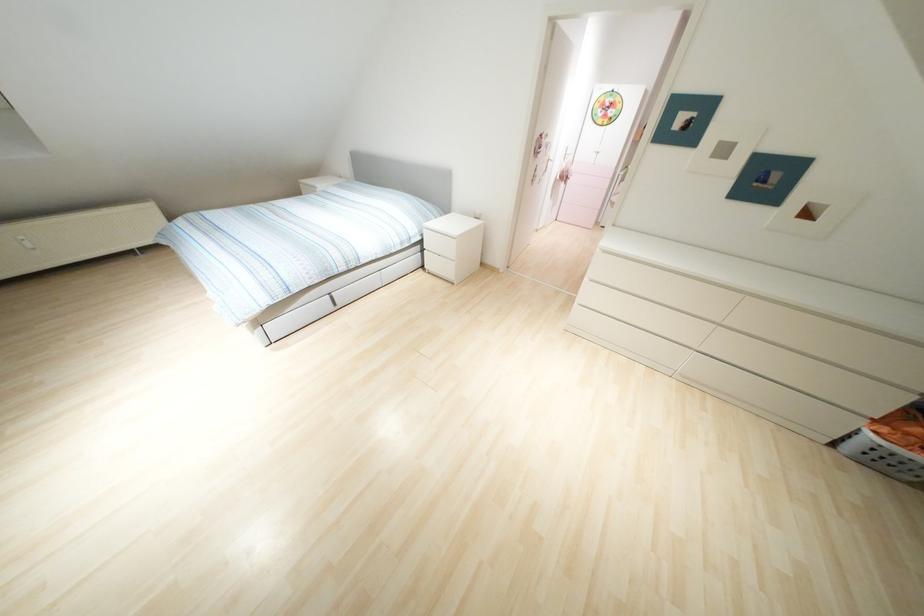
Image resolution: width=924 pixels, height=616 pixels. I want to click on laundry basket, so click(x=890, y=444).